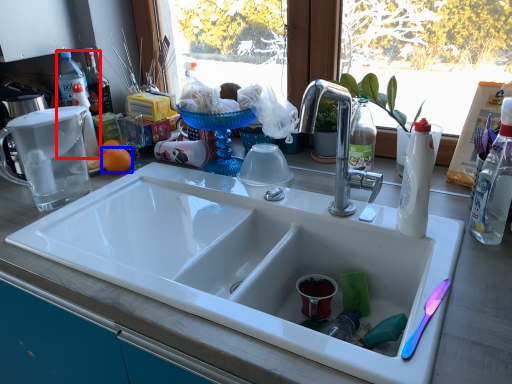
Question: Among these objects, which one is farthest to the camera, bottle (highlighted by a red box) or orange (highlighted by a blue box)?

Choices:
 (A) bottle
 (B) orange

Answer: (A)